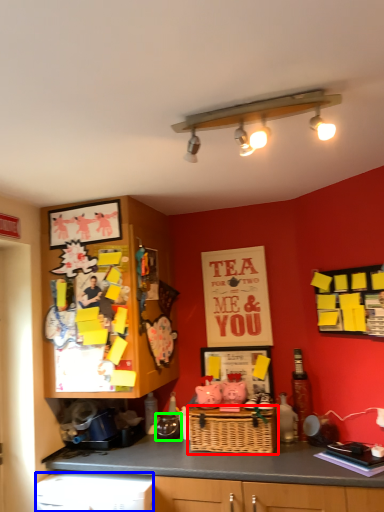
Question: Which object is the farthest from basket (highlighted by a red box)? Choose among these: dish washer (highlighted by a blue box) or appliance (highlighted by a green box).

Choices:
 (A) dish washer
 (B) appliance

Answer: (A)